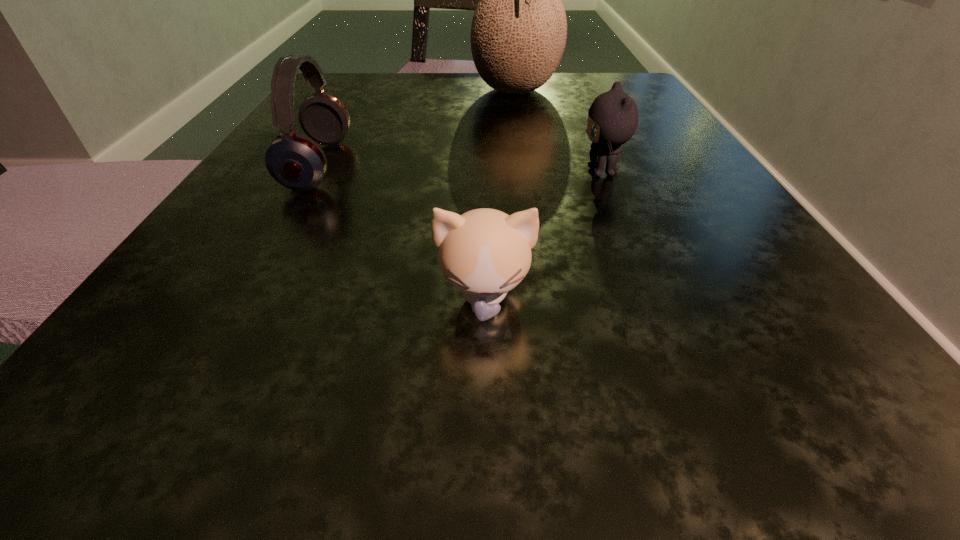
The width and height of the screenshot is (960, 540). In order to click on free space at the far left corner of the desktop in this screenshot , I will do `click(356, 74)`.

Where is `free spot at the far right corner of the desktop`? The image size is (960, 540). free spot at the far right corner of the desktop is located at coordinates (566, 97).

The width and height of the screenshot is (960, 540). I want to click on vacant area at the near right corner of the desktop, so click(709, 449).

This screenshot has width=960, height=540. Find the location of `vacant region between the tallest object and the nearest object`. vacant region between the tallest object and the nearest object is located at coordinates (500, 195).

I want to click on unoccupied position between the earphone and the farther kitten, so click(x=460, y=168).

This screenshot has height=540, width=960. Identify the location of free space between the nearest object and the farthest object. (500, 195).

The width and height of the screenshot is (960, 540). Identify the location of free space between the leftmost object and the cantaloup. click(417, 128).

Locate an element on the screen. vacant space that is in between the right kitten and the left kitten is located at coordinates (543, 235).

You are a GUI agent. You are given a task and a screenshot of the screen. Output one action in this format:
    pyautogui.click(x=<x>, y=<y>)
    Task: Click on the free space between the nearest object and the leftmost object
    
    Given the screenshot: What is the action you would take?
    pyautogui.click(x=401, y=232)

You are a GUI agent. You are given a task and a screenshot of the screen. Output one action in this format:
    pyautogui.click(x=<x>, y=<y>)
    Task: Click on the vacant area between the second tallest object and the farthest object
    This screenshot has width=960, height=540.
    Given the screenshot: What is the action you would take?
    (417, 128)